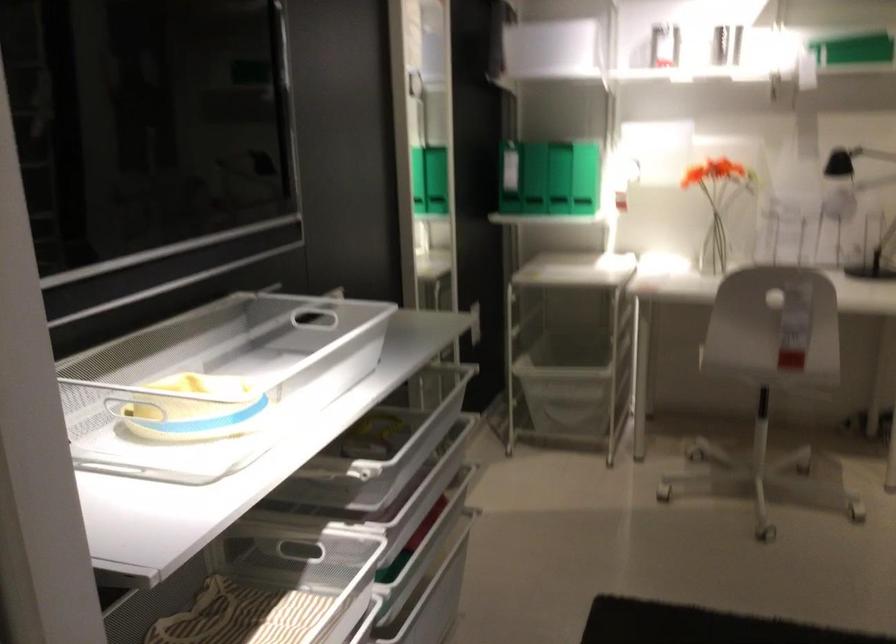
Where would you lift the glass vase? Please return your answer as a coordinate pair (x, y).

(713, 247)